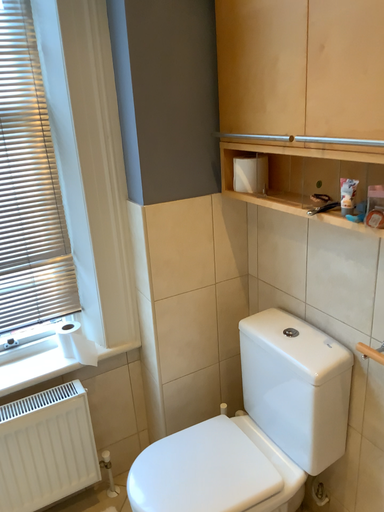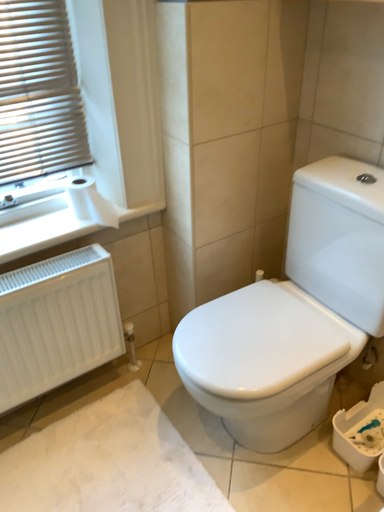
Question: Which way did the camera rotate in the video?

Choices:
 (A) rotated downward
 (B) rotated upward

Answer: (A)